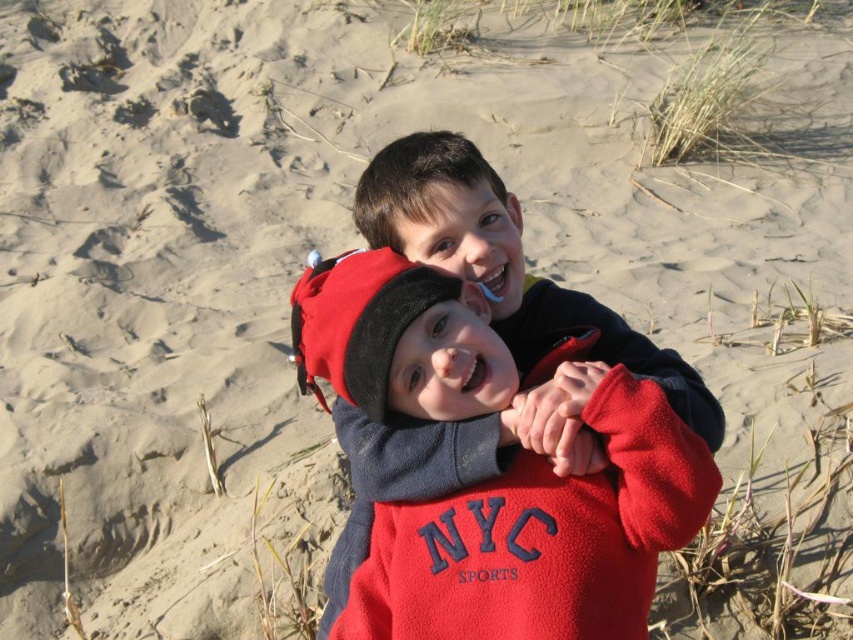
Question: Observing the image, what is the correct spatial positioning of red fleece sweatshirt at center in reference to matte black jacket at center?

Choices:
 (A) right
 (B) left

Answer: (B)

Question: Considering the relative positions of red fleece sweatshirt at center and matte black jacket at center in the image provided, where is red fleece sweatshirt at center located with respect to matte black jacket at center?

Choices:
 (A) below
 (B) above

Answer: (A)

Question: Can you confirm if red fleece sweatshirt at center is positioned to the left of matte black jacket at center?

Choices:
 (A) no
 (B) yes

Answer: (B)

Question: Which object appears farthest from the camera in this image?

Choices:
 (A) matte black jacket at center
 (B) red fleece sweatshirt at center

Answer: (A)

Question: Which point is closer to the camera taking this photo?

Choices:
 (A) (x=495, y=296)
 (B) (x=664, y=541)

Answer: (B)